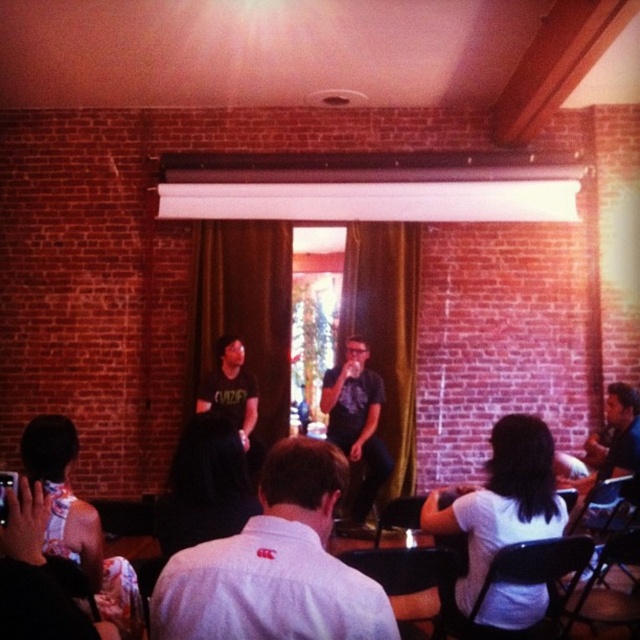
Is white cotton shirt at center wider than matte black shirt at center?

A: Yes, white cotton shirt at center is wider than matte black shirt at center.

Is white cotton shirt at center taller than matte black shirt at center?

No.

Is point (332, 516) positioned after point (356, 442)?

That is False.

The width and height of the screenshot is (640, 640). In order to click on white cotton shirt at center in this screenshot , I will do `click(275, 564)`.

Can you confirm if white cotton shirt at center is positioned to the left of black matte shirt at center?

Incorrect, white cotton shirt at center is not on the left side of black matte shirt at center.

Can you confirm if white cotton shirt at center is thinner than black matte shirt at center?

In fact, white cotton shirt at center might be wider than black matte shirt at center.

Is point (328, 580) less distant than point (227, 340)?

Yes.

The height and width of the screenshot is (640, 640). Identify the location of white cotton shirt at center. (275, 564).

Does point (326, 394) lie in front of point (237, 432)?

No, (326, 394) is further to viewer.

Between point (372, 422) and point (237, 396), which one is positioned in front?

Point (237, 396)

Where is `matte black shirt at center`? The image size is (640, 640). matte black shirt at center is located at coordinates (356, 420).